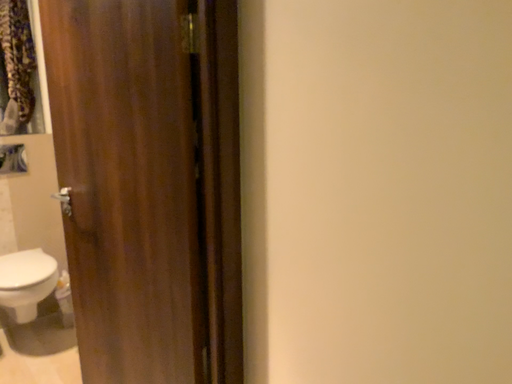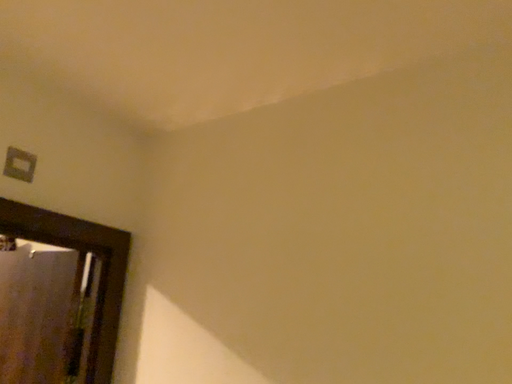
Question: Which way did the camera rotate in the video?

Choices:
 (A) rotated upward
 (B) rotated downward

Answer: (A)